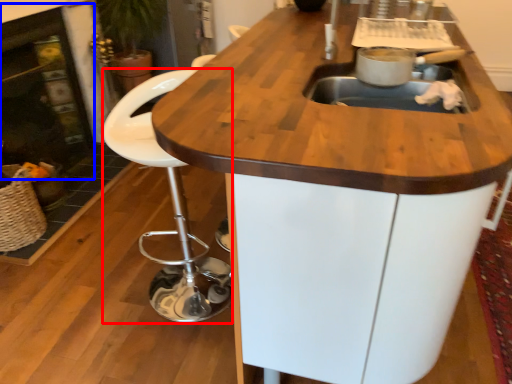
Question: Which point is closer to the camera, chair (highlighted by a red box) or fireplace (highlighted by a blue box)?

Choices:
 (A) chair
 (B) fireplace

Answer: (A)